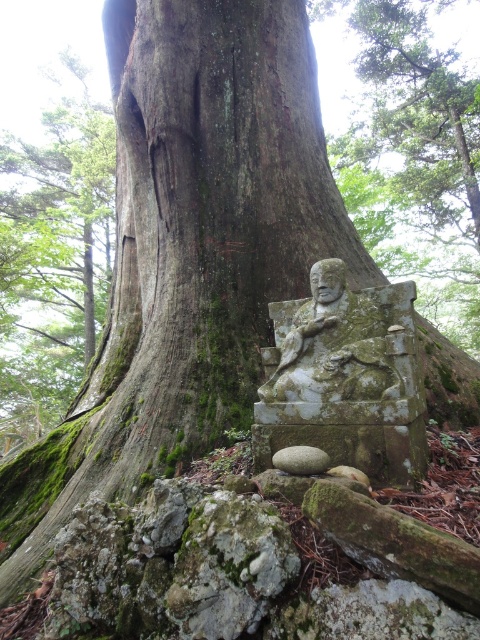
Question: Which of the following is the closest to the observer?

Choices:
 (A) green mossy stone statue at lower center
 (B) green mossy stone statue at center
 (C) green mossy bark at lower left
 (D) gray rough stone at lower center

Answer: (D)

Question: Which object is farther from the camera taking this photo?

Choices:
 (A) green mossy stone statue at center
 (B) green mossy bark at lower left

Answer: (B)

Question: Does green mossy bark at lower left have a larger size compared to green mossy stone statue at center?

Choices:
 (A) no
 (B) yes

Answer: (B)

Question: Can you confirm if green mossy bark at lower left is smaller than gray rough stone at lower center?

Choices:
 (A) yes
 (B) no

Answer: (B)

Question: Can you confirm if green mossy stone statue at lower center is positioned to the right of green mossy bark at lower left?

Choices:
 (A) yes
 (B) no

Answer: (A)

Question: Which object appears closest to the camera in this image?

Choices:
 (A) gray rough stone at lower center
 (B) green mossy stone statue at center
 (C) green mossy bark at lower left
 (D) green mossy stone statue at lower center

Answer: (A)